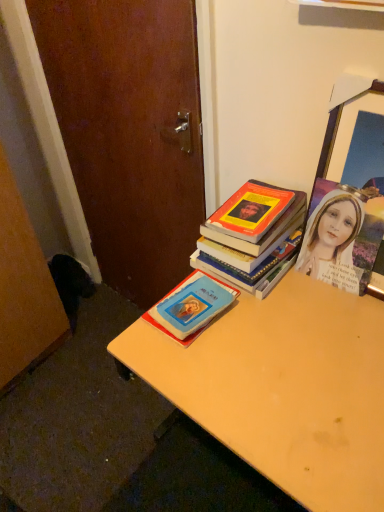
Question: Could you tell me if blue matte book at center, the first book ordered from the bottom, is turned towards light brown wooden desk at center?

Choices:
 (A) yes
 (B) no

Answer: (B)

Question: Is blue matte book at center, the first book ordered from the bottom, outside of light brown wooden desk at center?

Choices:
 (A) yes
 (B) no

Answer: (B)

Question: Does blue matte book at center, the first book ordered from the bottom, have a lesser width compared to light brown wooden desk at center?

Choices:
 (A) no
 (B) yes

Answer: (B)

Question: From a real-world perspective, does blue matte book at center, arranged as the second book when viewed from the top, sit lower than light brown wooden desk at center?

Choices:
 (A) yes
 (B) no

Answer: (B)

Question: From the image's perspective, is blue matte book at center, arranged as the second book when viewed from the top, under light brown wooden desk at center?

Choices:
 (A) yes
 (B) no

Answer: (B)

Question: From the image's perspective, is wooden picture frame at upper right positioned above or below blue matte book at center, arranged as the second book when viewed from the top?

Choices:
 (A) below
 (B) above

Answer: (B)

Question: Is wooden picture frame at upper right taller or shorter than blue matte book at center, arranged as the second book when viewed from the top?

Choices:
 (A) short
 (B) tall

Answer: (B)

Question: From a real-world perspective, is wooden picture frame at upper right physically located above or below blue matte book at center, the first book ordered from the bottom?

Choices:
 (A) below
 (B) above

Answer: (B)

Question: Does point (322, 244) appear closer or farther from the camera than point (180, 286)?

Choices:
 (A) closer
 (B) farther

Answer: (A)

Question: Is light brown wooden desk at center bigger or smaller than wooden picture frame at upper right?

Choices:
 (A) big
 (B) small

Answer: (A)

Question: From a real-world perspective, is light brown wooden desk at center above or below wooden picture frame at upper right?

Choices:
 (A) above
 (B) below

Answer: (B)

Question: Considering the positions of light brown wooden desk at center and wooden picture frame at upper right in the image, is light brown wooden desk at center wider or thinner than wooden picture frame at upper right?

Choices:
 (A) wide
 (B) thin

Answer: (A)

Question: From their relative heights in the image, would you say light brown wooden desk at center is taller or shorter than wooden picture frame at upper right?

Choices:
 (A) tall
 (B) short

Answer: (A)

Question: Is wooden picture frame at upper right to the left or to the right of hardcover book at center, which ranks as the 1th book in top-to-bottom order, in the image?

Choices:
 (A) left
 (B) right

Answer: (B)

Question: Considering the positions of wooden picture frame at upper right and hardcover book at center, which is the second book from bottom to top, in the image, is wooden picture frame at upper right taller or shorter than hardcover book at center, which is the second book from bottom to top,?

Choices:
 (A) short
 (B) tall

Answer: (B)